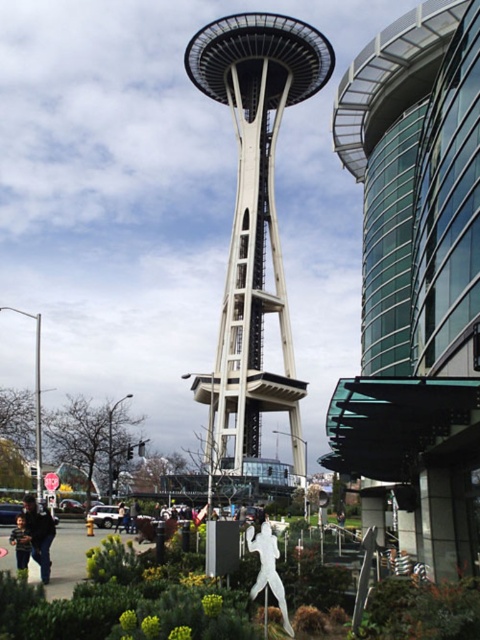
Is point (37, 534) positioned after point (16, 524)?

No, (37, 534) is in front of (16, 524).

Is dark blue jeans at lower left wider than matte black jacket at lower left?

Yes, dark blue jeans at lower left is wider than matte black jacket at lower left.

Locate an element on the screen. The width and height of the screenshot is (480, 640). dark blue jeans at lower left is located at coordinates (38, 534).

Can you confirm if dark blue jeans at lower left is positioned above skinny jeans at center?

Correct, dark blue jeans at lower left is located above skinny jeans at center.

Which is behind, point (38, 557) or point (122, 515)?

Positioned behind is point (122, 515).

At what (x,y) coordinates should I click in order to perform the action: click on dark blue jeans at lower left. Please return your answer as a coordinate pair (x, y). Looking at the image, I should click on (38, 534).

Which is behind, point (21, 547) or point (120, 520)?

Point (120, 520)

Based on the photo, does matte black jacket at lower left appear on the right side of skinny jeans at center?

Incorrect, matte black jacket at lower left is not on the right side of skinny jeans at center.

Who is more forward, (23,531) or (123,516)?

Positioned in front is point (23,531).

Find the location of `matte black jacket at lower left`. matte black jacket at lower left is located at coordinates point(21,545).